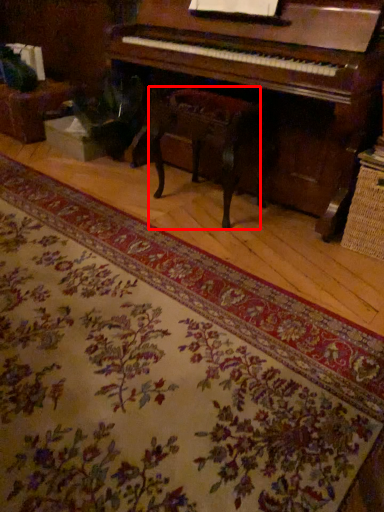
Question: From the image's perspective, what is the correct spatial relationship of music stool (annotated by the red box) in relation to mat?

Choices:
 (A) above
 (B) below

Answer: (A)